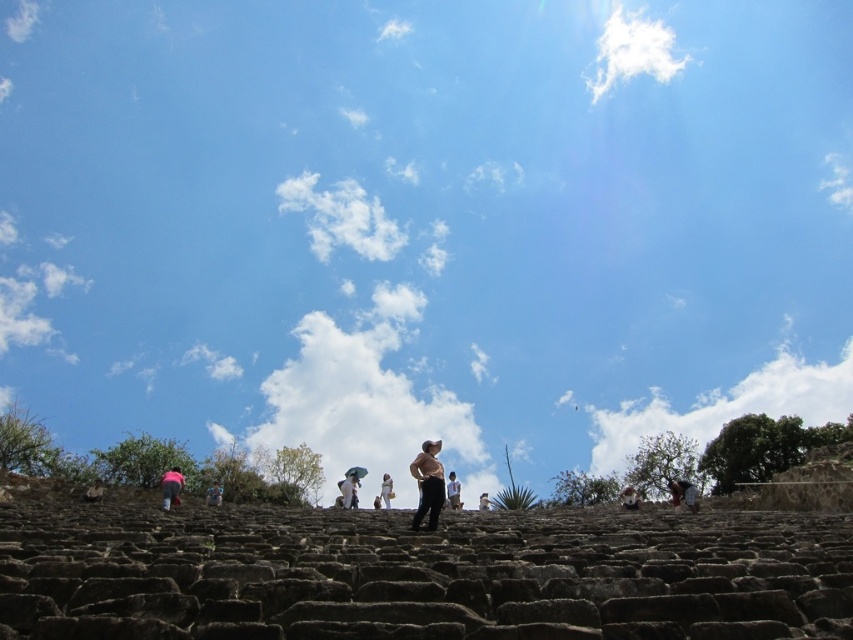
You are standing at the bottom of the brown stone steps at center and want to reach a person standing at the top. If your walking speed is 1.5 meters per second, how long will it take you to reach them?

The distance of brown stone steps at center from viewer is 29.63 meters. At a walking speed of 1.5 meters per second, it would take approximately 19.75 seconds to reach the person at the top.

You are standing on the stone steps and see the brown leather jacket at lower right and the light brown stone person at center. Which object is positioned more to the right side of the scene?

The brown leather jacket at lower right is positioned more to the right side of the scene than the light brown stone person at center.

You are standing at the bottom of the brown stone steps at center. Looking up, where would you see the point marked at coordinates (x=419, y=573)?

The point marked at coordinates (x=419, y=573) is located at the center of the brown stone steps at center.